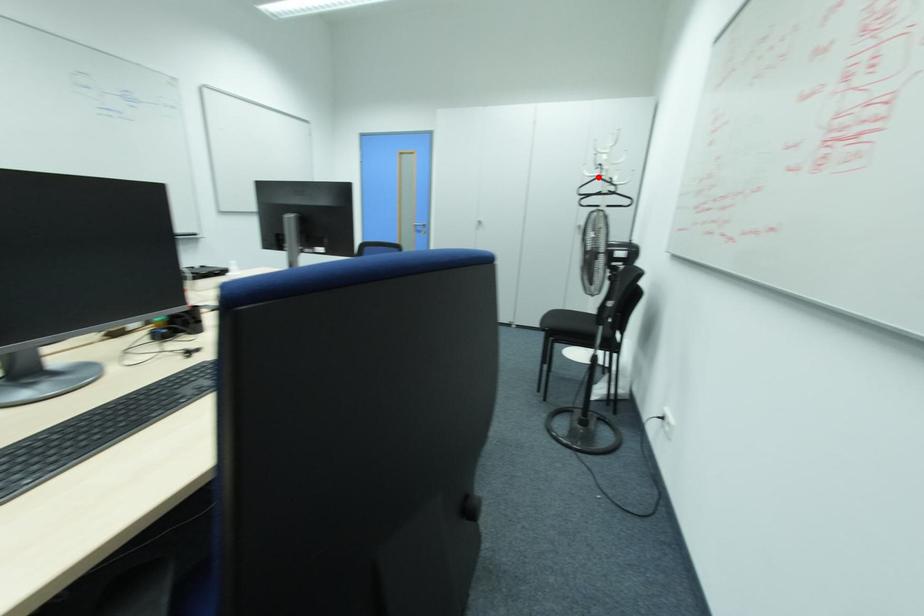
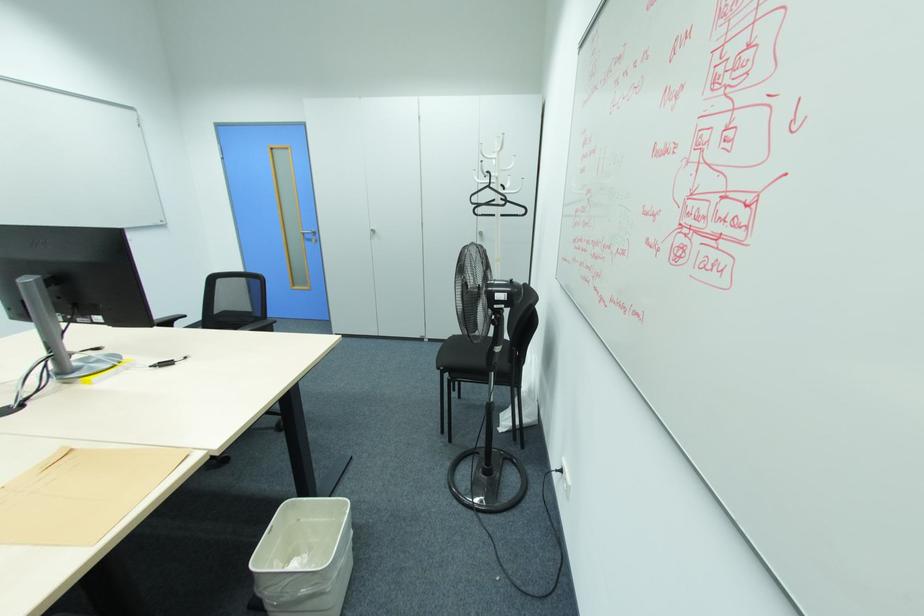
Locate, in the second image, the point that corresponds to the highlighted location in the first image.

(490, 187)